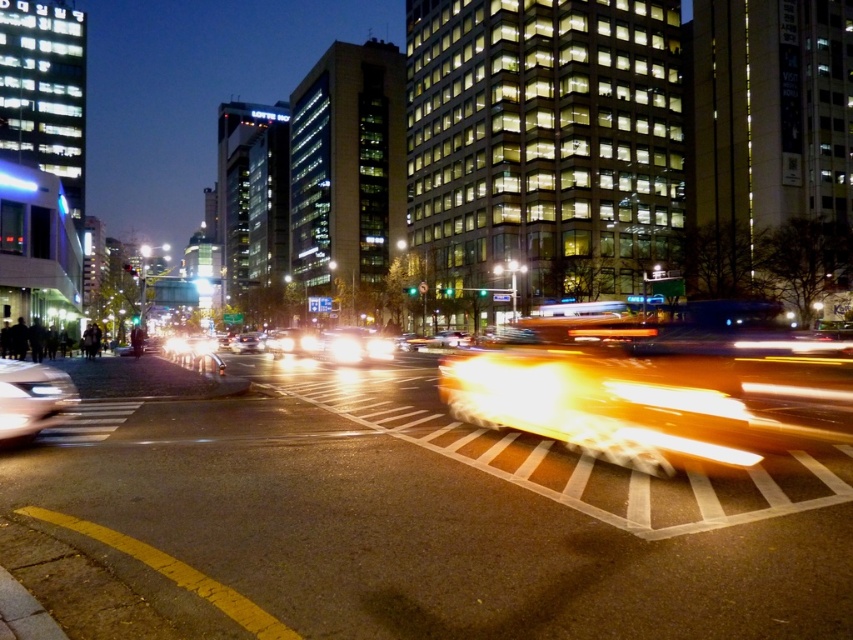
Question: Considering the relative positions of yellow metallic taxi at center and shiny silver car at lower left in the image provided, where is yellow metallic taxi at center located with respect to shiny silver car at lower left?

Choices:
 (A) below
 (B) above

Answer: (B)

Question: Estimate the real-world distances between objects in this image. Which object is farther from the shiny silver sedan at center?

Choices:
 (A) shiny silver car at lower left
 (B) yellow metallic car at center

Answer: (A)

Question: Which of the following is the farthest from the observer?

Choices:
 (A) dark gray concrete crowd at lower left
 (B) shiny silver car at lower left

Answer: (A)

Question: Is dark gray concrete crowd at lower left behind yellow metallic car at center?

Choices:
 (A) no
 (B) yes

Answer: (A)

Question: Is yellow metallic taxi at center smaller than dark gray concrete crowd at lower left?

Choices:
 (A) no
 (B) yes

Answer: (A)

Question: Which of the following is the farthest from the observer?

Choices:
 (A) yellow metallic car at center
 (B) shiny silver car at lower left
 (C) shiny silver sedan at center

Answer: (A)